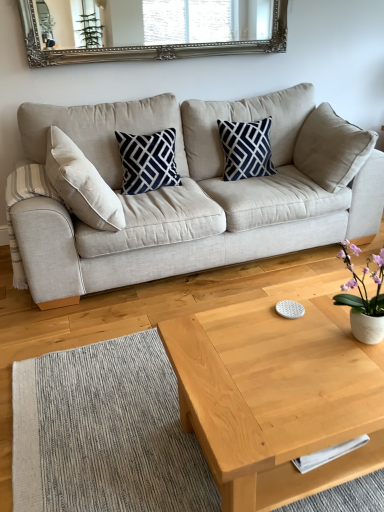
Identify the location of free region under white ceramic vase at right (from a real-world perspective). Image resolution: width=384 pixels, height=512 pixels. (352, 342).